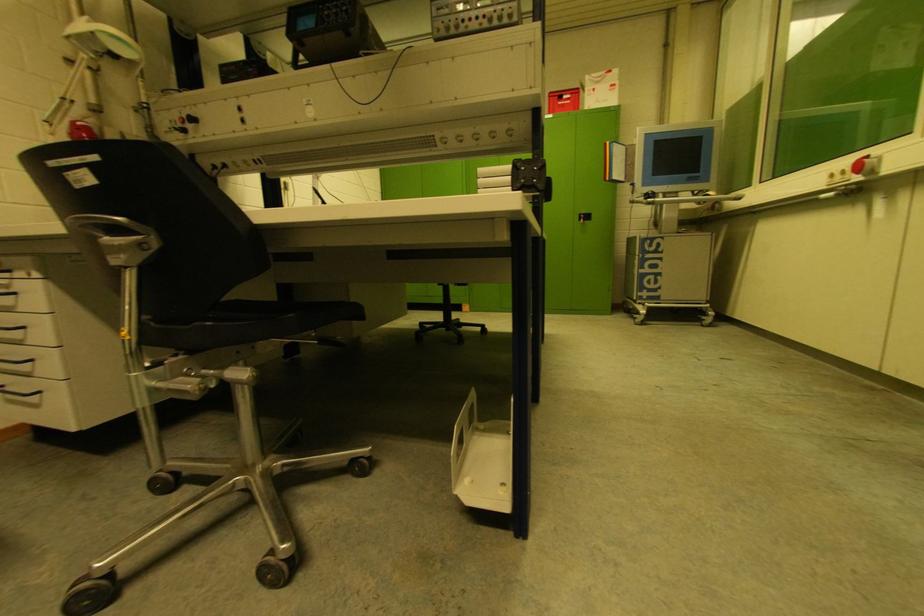
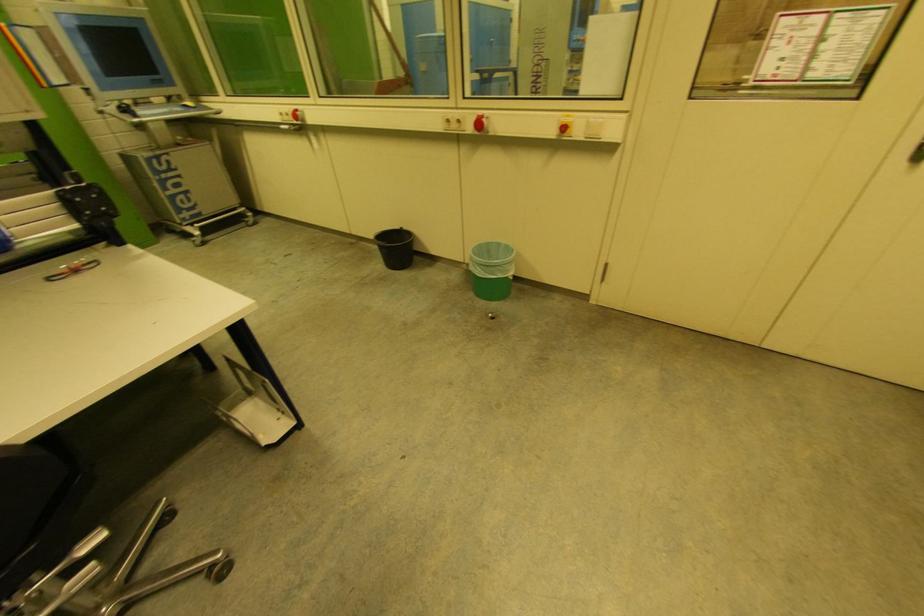
First-person continuous shooting, in which direction is the camera rotating?

The rotation direction of the camera is right-down.